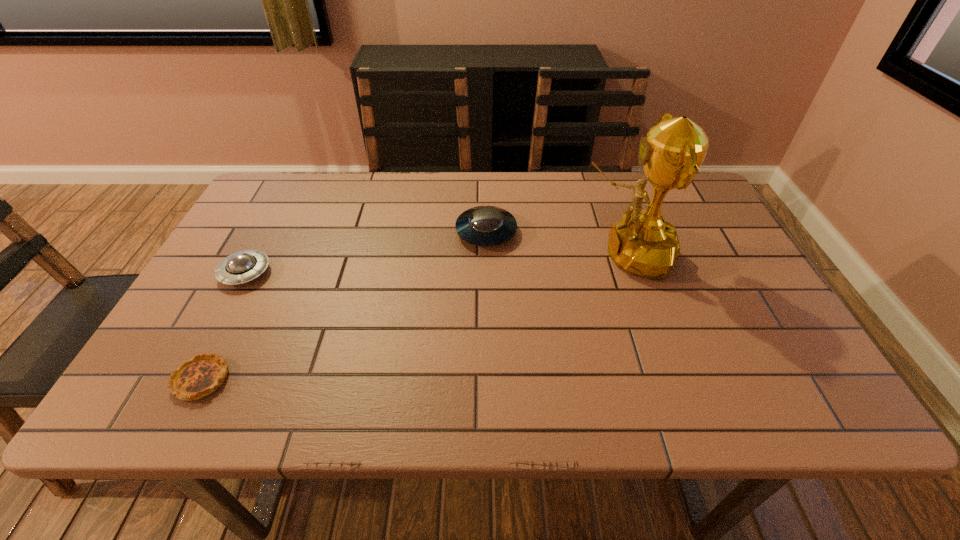
Locate an element on the screen. This screenshot has width=960, height=540. vacant space that is in between the left saucer and the second object from right to left is located at coordinates (366, 252).

Locate an element on the screen. vacant region between the quiche and the award is located at coordinates (414, 316).

Where is `empty space that is in between the third object from left to right and the left saucer`? empty space that is in between the third object from left to right and the left saucer is located at coordinates (x=366, y=252).

Find the location of a particular element. The width and height of the screenshot is (960, 540). free spot between the shortest object and the nearer saucer is located at coordinates pos(223,326).

The height and width of the screenshot is (540, 960). Identify the location of object that is the third closest one to the award. (202, 375).

Identify which object is the second closest to the nearest object. Please provide its 2D coordinates. Your answer should be formatted as a tuple, i.e. [(x, y)], where the tuple contains the x and y coordinates of a point satisfying the conditions above.

[(484, 225)]

This screenshot has height=540, width=960. Find the location of `vacant area in the image that satisfies the following two spatial constraints: 1. on the front side of the rightmost object; 2. on the front side of the quiche`. vacant area in the image that satisfies the following two spatial constraints: 1. on the front side of the rightmost object; 2. on the front side of the quiche is located at coordinates (670, 379).